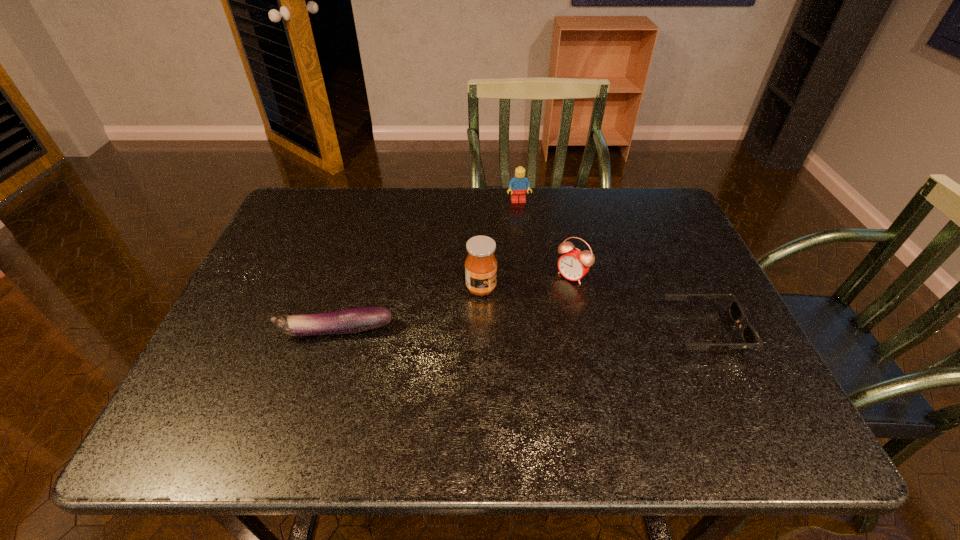
Image resolution: width=960 pixels, height=540 pixels. What are the coordinates of `vacant space located on the front-facing side of the tallest object` in the screenshot? It's located at (624, 363).

I want to click on free space located on the front-facing side of the tallest object, so click(577, 339).

Where is `free space located on the front-facing side of the tallest object`? The height and width of the screenshot is (540, 960). free space located on the front-facing side of the tallest object is located at coordinates (589, 345).

Image resolution: width=960 pixels, height=540 pixels. I want to click on vacant space located 0.060m on the clock face of the alarm clock, so click(x=550, y=297).

Where is `free region located 0.050m on the clock face of the alarm clock`? free region located 0.050m on the clock face of the alarm clock is located at coordinates (553, 295).

What are the coordinates of `vacant space located 0.110m on the clock face of the alarm clock` in the screenshot? It's located at (539, 309).

Where is `free location located on the face of the farthest object`? The image size is (960, 540). free location located on the face of the farthest object is located at coordinates (543, 293).

You are a GUI agent. You are given a task and a screenshot of the screen. Output one action in this format:
    pyautogui.click(x=<x>, y=<y>)
    Task: Click on the free space located on the face of the farthest object
    
    Given the screenshot: What is the action you would take?
    pyautogui.click(x=523, y=217)

At what (x,y) coordinates should I click in order to perform the action: click on vacant space situated on the face of the farthest object. Please return your answer as a coordinate pair (x, y). This screenshot has width=960, height=540. Looking at the image, I should click on (534, 256).

Identify the location of object that is at the far edge. (519, 183).